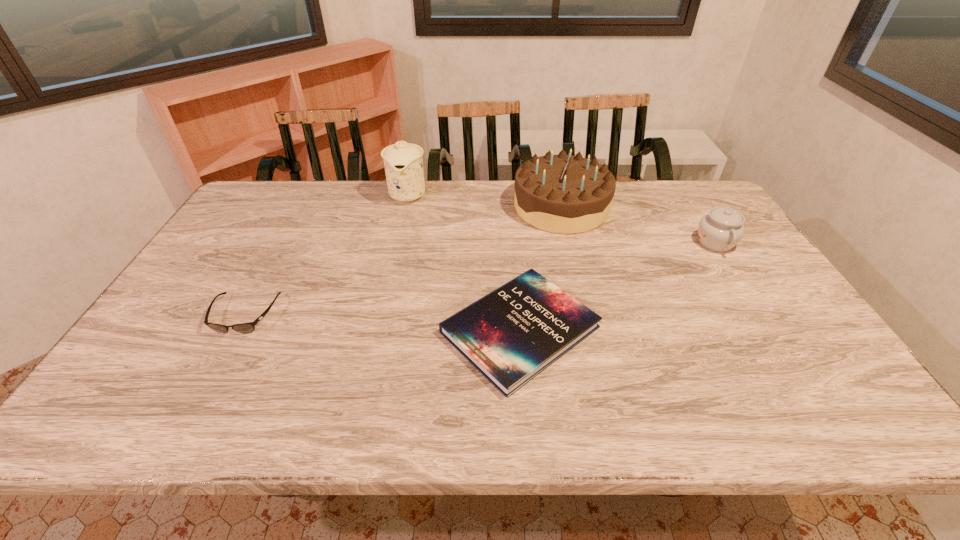
This screenshot has width=960, height=540. Find the location of `free space located 0.370m on the front-facing side of the fourth shortest object`. free space located 0.370m on the front-facing side of the fourth shortest object is located at coordinates (405, 207).

Locate an element on the screen. free space located on the front-facing side of the fourth shortest object is located at coordinates (490, 207).

I want to click on vacant space located 0.240m on the back of the nearer chinaware, so click(681, 188).

You are a GUI agent. You are given a task and a screenshot of the screen. Output one action in this format:
    pyautogui.click(x=<x>, y=<y>)
    Task: Click on the free point located on the front-facing side of the leftmost object
    Image resolution: width=960 pixels, height=540 pixels.
    Given the screenshot: What is the action you would take?
    pyautogui.click(x=211, y=377)

Where is `blank space located 0.130m on the left of the shortest object`? blank space located 0.130m on the left of the shortest object is located at coordinates (388, 329).

Find the location of a particular element. This screenshot has height=540, width=960. chinaware that is at the far edge is located at coordinates (403, 162).

The height and width of the screenshot is (540, 960). What are the coordinates of `birthday cake at the far edge` in the screenshot? It's located at (561, 193).

Image resolution: width=960 pixels, height=540 pixels. In order to click on object that is positioned at the near edge in this screenshot , I will do `click(512, 334)`.

Identify the location of object situated at the left edge. The width and height of the screenshot is (960, 540). (249, 327).

Identify the location of object that is at the right edge. Image resolution: width=960 pixels, height=540 pixels. (720, 230).